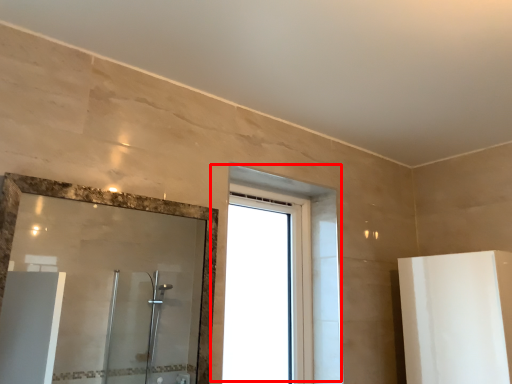
Question: Where is window (annotated by the red box) located in relation to mirror in the image?

Choices:
 (A) left
 (B) right

Answer: (B)